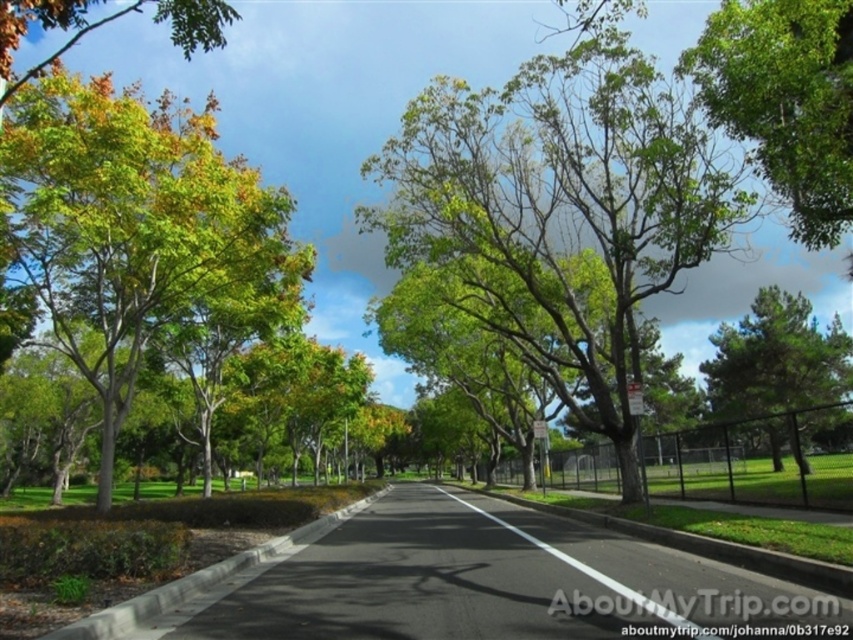
You are a pedestrian standing at the start of the road and want to walk towards the green leafy tree at center. Which direction should you go to avoid the green leafy tree at left?

The green leafy tree at center is larger in size than the green leafy tree at left, so you should walk straight ahead towards the larger tree to avoid the smaller one on the left.

You are a hiker planning to take a photo of the green leafy tree at center and the green leafy tree at upper left from the road. Which tree will appear taller in the photo?

The green leafy tree at upper left will appear taller in the photo because it is taller than the green leafy tree at center.

You are a pedestrian standing at the start of the road and want to walk towards the green textured pine tree at right. Which direction should you turn to avoid the green leafy tree at center?

The green leafy tree at center is to the left of the green textured pine tree at right. To reach the green textured pine tree at right while avoiding the green leafy tree at center, you should turn to the right side of the road since the pine tree is positioned further to the right compared to the leafy tree.